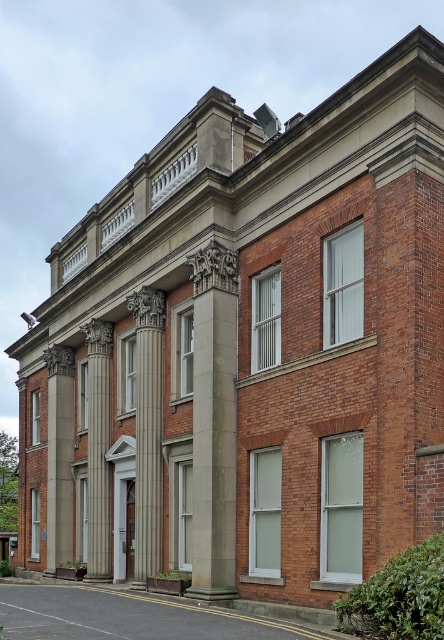
You are an architect planning to install a decorative archway between the gray stone column at center and the polished stone column at left. The archway requires a minimum of 8 meters of space between the two columns to be installed. Based on the scene description, is the available space sufficient for the archway?

The distance between the gray stone column at center and the polished stone column at left is 7.25 meters, which is less than the required 8 meters. Therefore, the space is insufficient for installing the archway.

You are standing in front of the building and notice two columns. The gray stone column at center and the polished stone column at left. Which column is positioned to the right of the other?

The gray stone column at center is positioned to the right of the polished stone column at left.

You are an architect evaluating the symmetry of the building. You notice two columns at the center of the facade, a gray stone column at center and a white marble column at center. Which column is larger in size?

The gray stone column at center is larger in size compared to the white marble column at center.